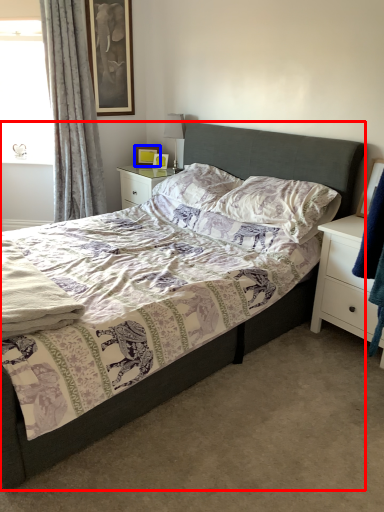
Question: Among these objects, which one is nearest to the camera, bed (highlighted by a red box) or picture frame (highlighted by a blue box)?

Choices:
 (A) bed
 (B) picture frame

Answer: (A)